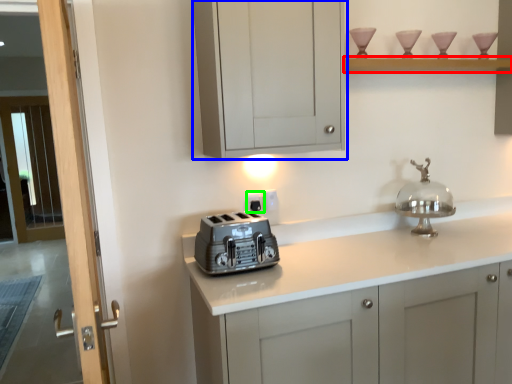
Question: Based on their relative distances, which object is farther from shelf (highlighted by a red box)? Choose from cabinetry (highlighted by a blue box) and electric outlet (highlighted by a green box).

Choices:
 (A) cabinetry
 (B) electric outlet

Answer: (B)